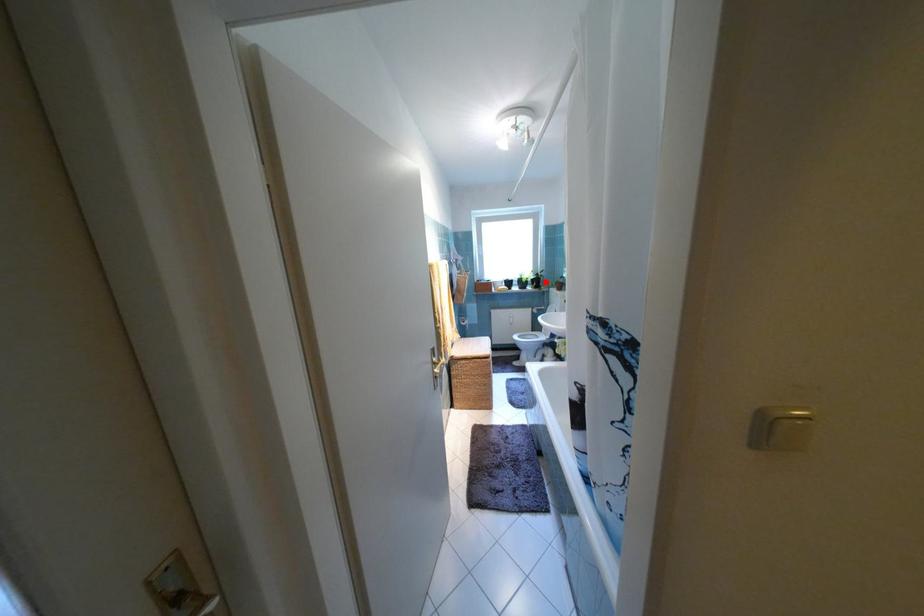
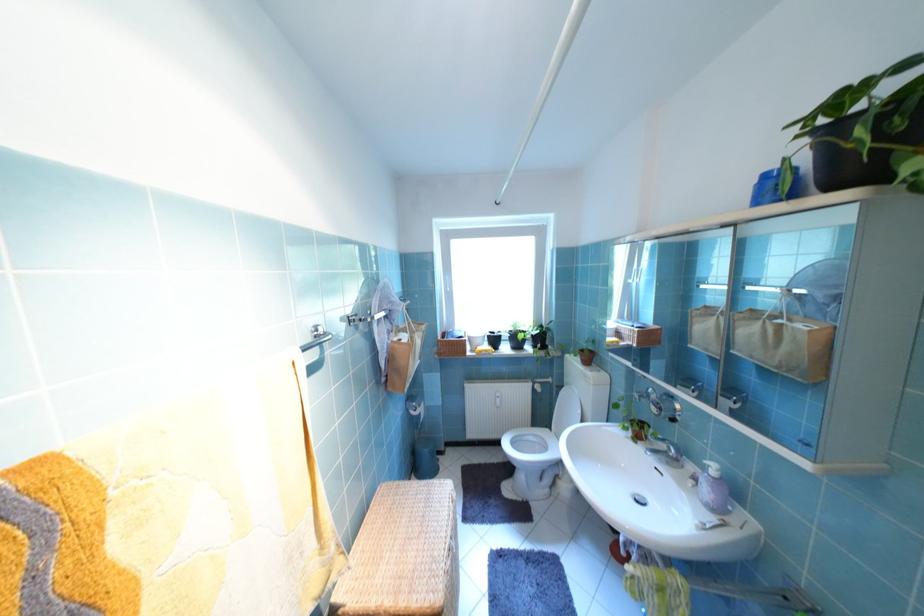
Question: A red point is marked in image1. In image2, is the corresponding 3D point closer to the camera or farther? Reply with the corresponding letter.

Choices:
 (A) The corresponding 3D point is closer.
 (B) The corresponding 3D point is farther.

Answer: (B)